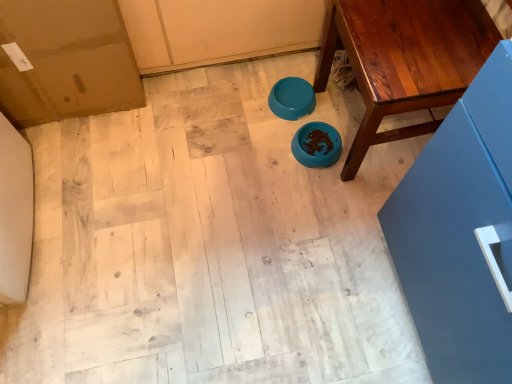
Image resolution: width=512 pixels, height=384 pixels. What are the coordinates of `vacant space to the right of blue matte bowl at center, marked as the 1th bowl in a bottom-to-top arrangement` in the screenshot? It's located at (352, 144).